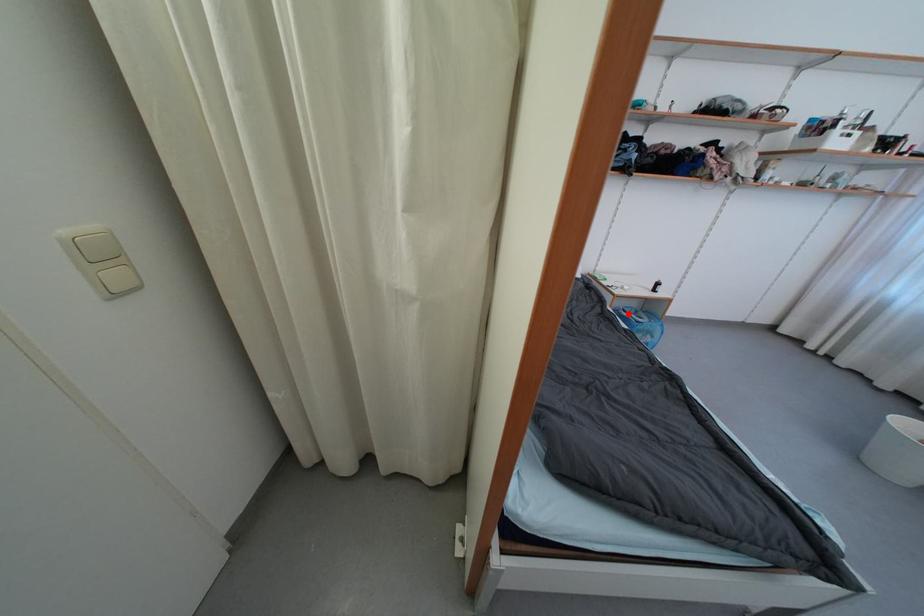
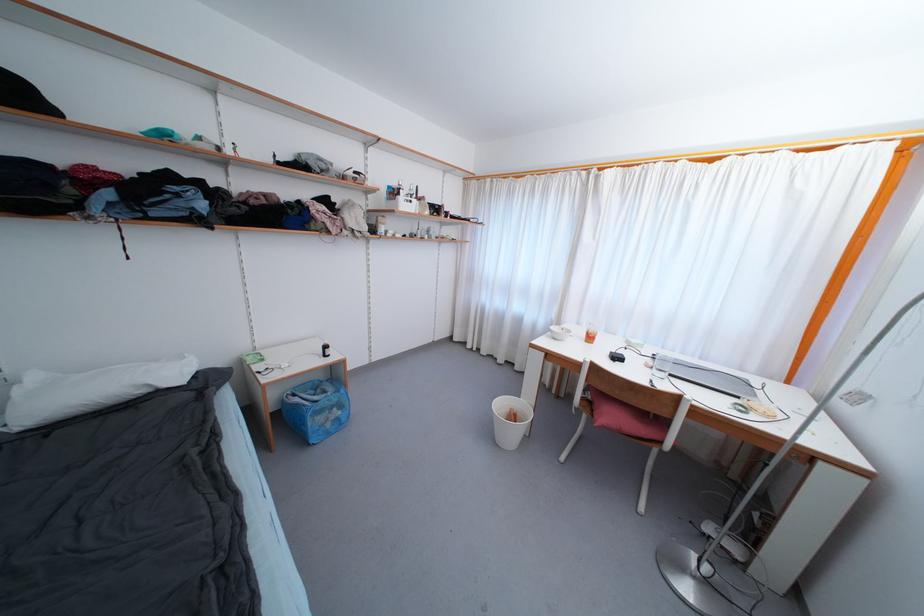
Find the pixel in the second image that matches the highlighted location in the first image.

(298, 398)